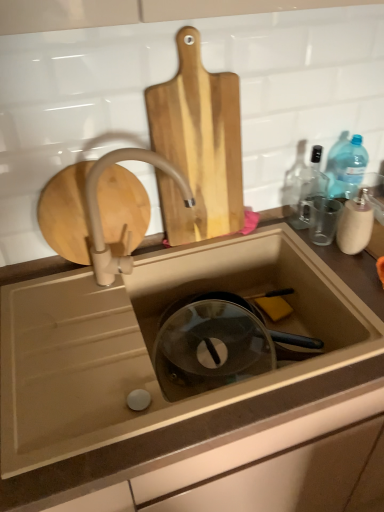
Find the location of a particular element. free spot in front of transparent glass bottle at upper right is located at coordinates (321, 254).